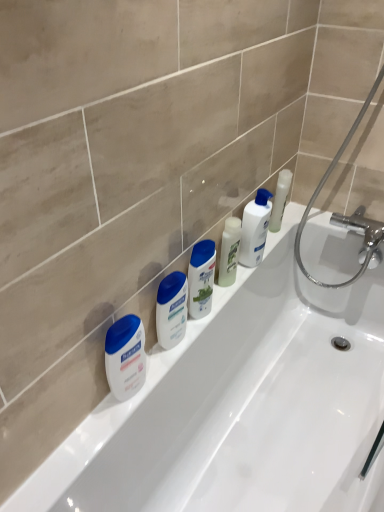
Question: Is point (253, 224) closer or farther from the camera than point (170, 342)?

Choices:
 (A) farther
 (B) closer

Answer: (A)

Question: In the image, is white glossy lotion at upper center, which appears as the 3th toiletry when viewed from the left, positioned in front of or behind white glossy lotion at center, the 1th toiletry in the left-to-right sequence?

Choices:
 (A) behind
 (B) front

Answer: (A)

Question: Which of these objects is positioned closest to the white matte lotion at left?

Choices:
 (A) white glossy lotion at center, which is counted as the third toiletry, starting from the right
 (B) white plastic shampoo bottle at center, positioned as the 2th toiletry in left-to-right order
 (C) white glossy bathtub at center
 (D) white glossy lotion at upper center, acting as the first toiletry starting from the right
 (E) chrome metallic shower at upper right

Answer: (A)

Question: Estimate the real-world distances between objects in this image. Which object is closer to the white glossy lotion at upper center, acting as the first toiletry starting from the right?

Choices:
 (A) white glossy lotion at center, the 1th toiletry in the left-to-right sequence
 (B) white glossy bathtub at center
 (C) white matte lotion at left
 (D) green matte bottle at center
 (E) chrome metallic shower at upper right

Answer: (D)